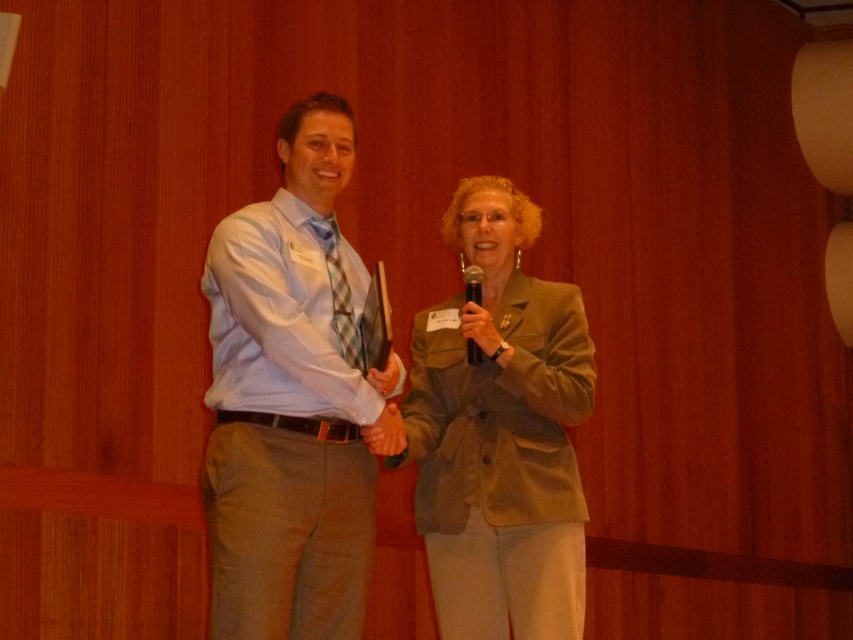
Question: Which of the following is the farthest from the observer?

Choices:
 (A) (235, 518)
 (B) (466, 276)

Answer: (B)

Question: Among these objects, which one is farthest from the camera?

Choices:
 (A) black plastic microphone at center
 (B) light blue shirt at center
 (C) matte green blazer at center

Answer: (A)

Question: Which is farther from the matte green blazer at center?

Choices:
 (A) light blue shirt at center
 (B) black plastic microphone at center

Answer: (A)

Question: Does light blue shirt at center lie in front of matte green blazer at center?

Choices:
 (A) no
 (B) yes

Answer: (B)

Question: Is light blue shirt at center to the left of matte green blazer at center from the viewer's perspective?

Choices:
 (A) no
 (B) yes

Answer: (B)

Question: Considering the relative positions of light blue shirt at center and matte green blazer at center in the image provided, where is light blue shirt at center located with respect to matte green blazer at center?

Choices:
 (A) below
 (B) above

Answer: (B)